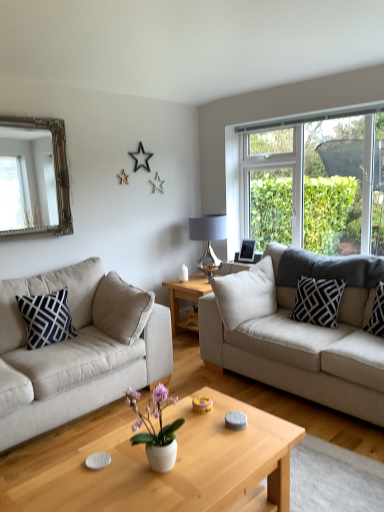
At what (x,y) coordinates should I click in order to perform the action: click on vacant space behind white ceramic pot at center. Please return your answer as a coordinate pair (x, y). The image size is (384, 512). Looking at the image, I should click on (175, 444).